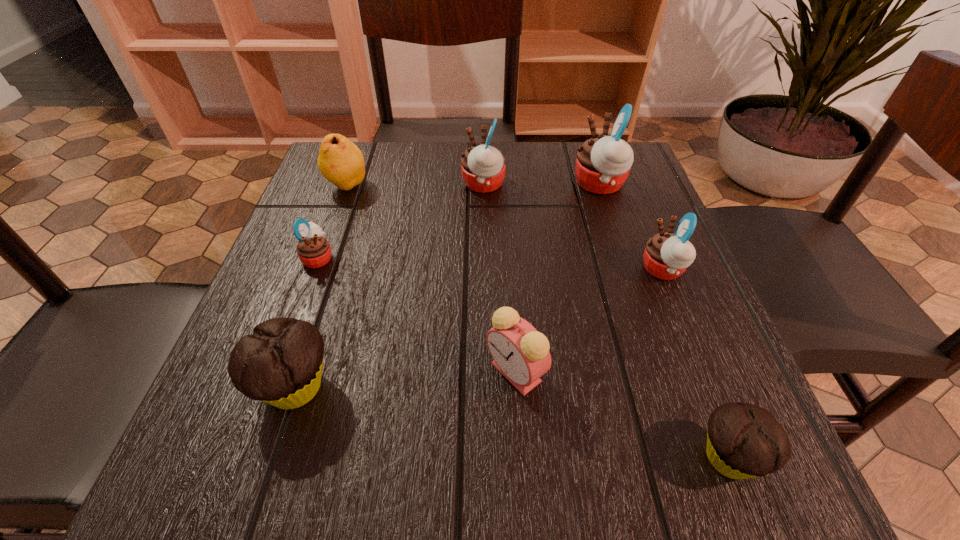
Identify the location of the tallest object. (603, 163).

You are a GUI agent. You are given a task and a screenshot of the screen. Output one action in this format:
    pyautogui.click(x=<x>, y=<y>)
    Task: Click on the tallest muffin
    
    Given the screenshot: What is the action you would take?
    pyautogui.click(x=603, y=163)

At what (x,y) coordinates should I click in order to perform the action: click on the fourth muffin from right to left. Please return your answer as a coordinate pair (x, y). Image resolution: width=960 pixels, height=540 pixels. Looking at the image, I should click on pos(483,167).

You are a GUI agent. You are given a task and a screenshot of the screen. Output one action in this format:
    pyautogui.click(x=<x>, y=<y>)
    Task: Click on the third pink muffin from right to left
    The width and height of the screenshot is (960, 540).
    Given the screenshot: What is the action you would take?
    pyautogui.click(x=483, y=167)

Locate an element on the screen. pear is located at coordinates (340, 161).

Find the location of a particular element. This screenshot has height=540, width=960. the second smallest pink muffin is located at coordinates (667, 255).

Find the location of a particular element. alarm clock is located at coordinates (521, 353).

At what (x,y) coordinates should I click in order to perform the action: click on the left chocolate muffin. Please return your answer as a coordinate pair (x, y). Looking at the image, I should click on (281, 363).

Find the location of `the leftmost pink muffin`. the leftmost pink muffin is located at coordinates (314, 251).

Identify the location of the right chocolate muffin. (744, 441).